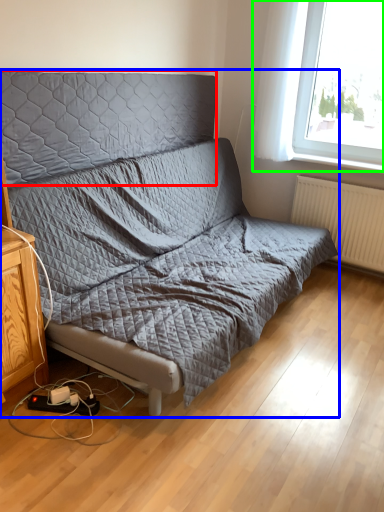
Question: Considering the real-world distances, which object is closest to headboard (highlighted by a red box)? studio couch (highlighted by a blue box) or window (highlighted by a green box).

Choices:
 (A) studio couch
 (B) window

Answer: (A)